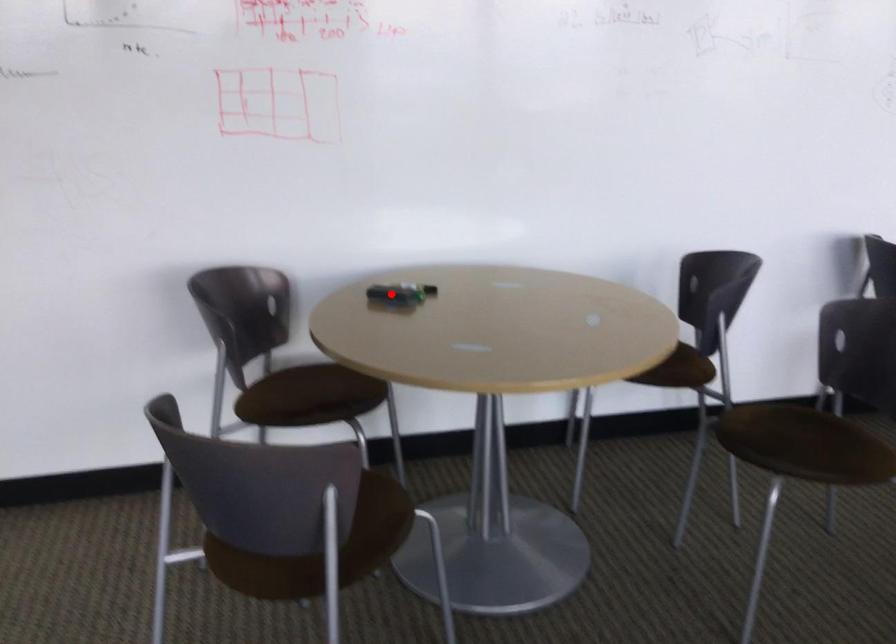
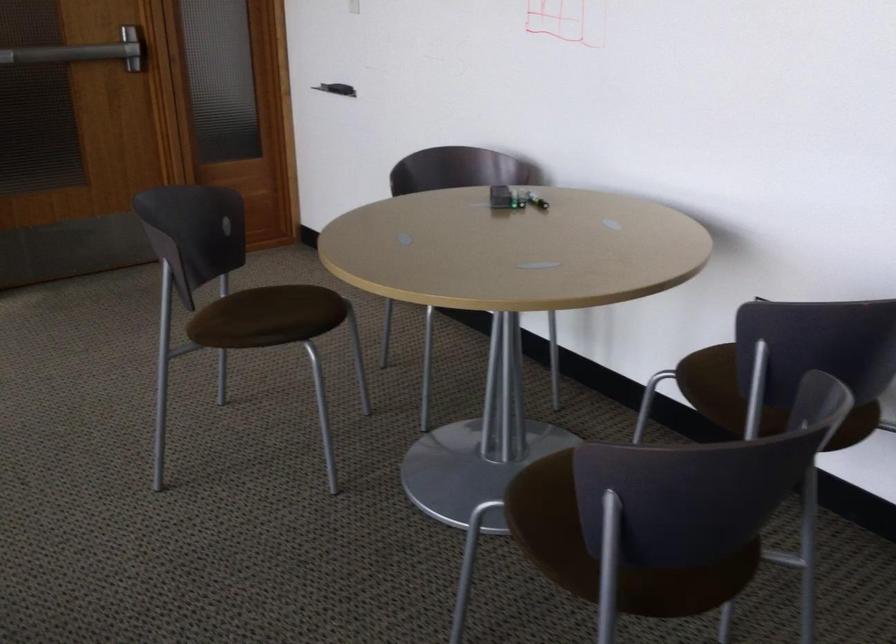
The point at the highlighted location is marked in the first image. Where is the corresponding point in the second image?

(515, 196)